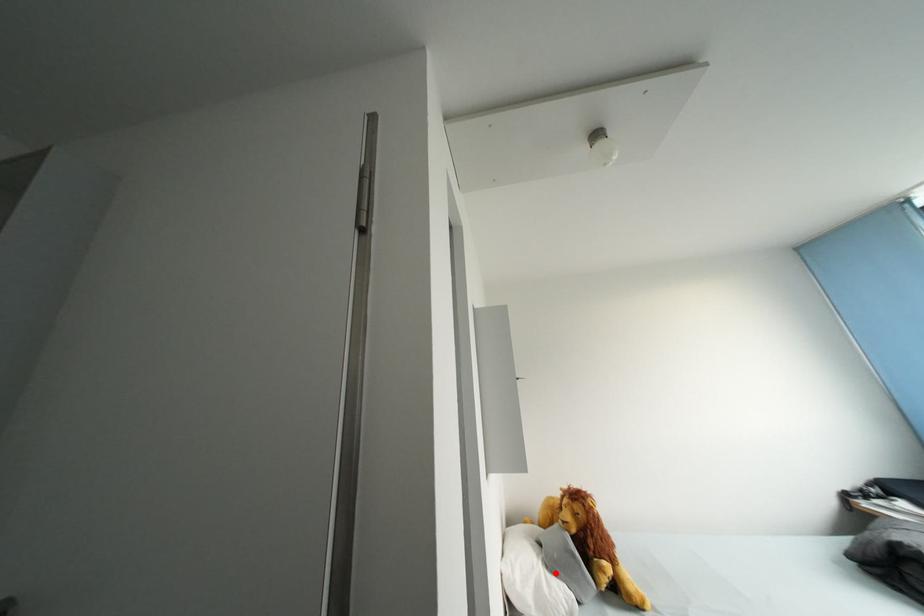
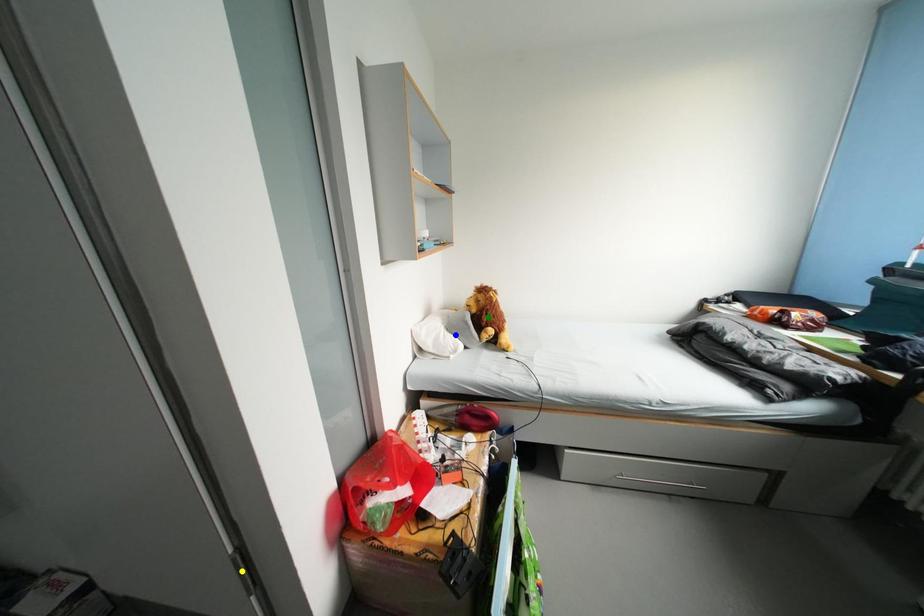
Question: I am providing you with two images of the same scene from different viewpoints. A red point is marked on the first image. You are given multiple points on the second image. Which point in image 2 represents the same 3d spot as the red point in image 1?

Choices:
 (A) blue point
 (B) yellow point
 (C) green point

Answer: (A)